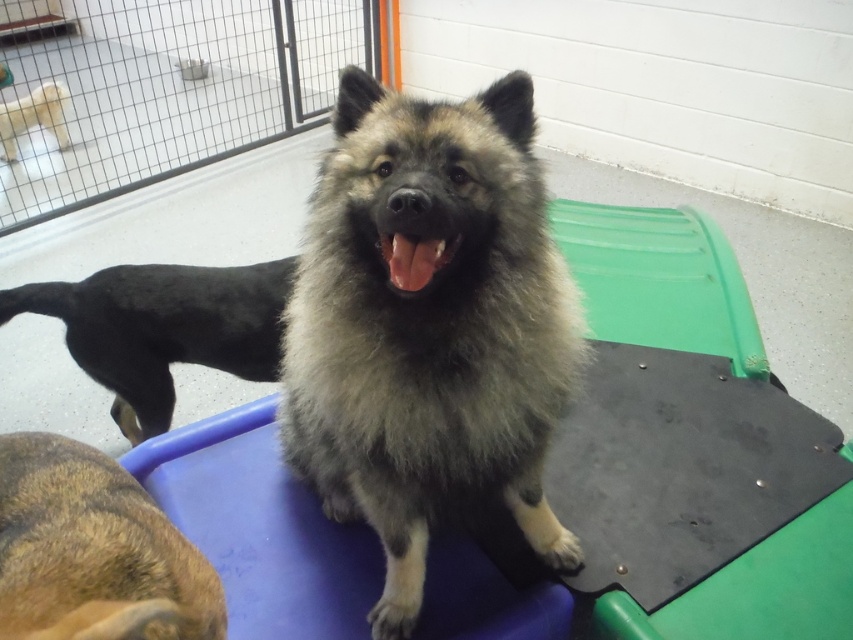
Is point (428, 220) behind point (10, 104)?

That is False.

Is fuzzy gray dog at center positioned at the back of light brown fur at upper left?

No.

Between point (310, 328) and point (28, 102), which one is positioned behind?

The point (28, 102) is behind.

Image resolution: width=853 pixels, height=640 pixels. Identify the location of fuzzy gray dog at center. (428, 326).

Measure the distance from brown fur at lower left to light brown fur at upper left.

brown fur at lower left is 4.10 meters from light brown fur at upper left.

Can you confirm if brown fur at lower left is positioned to the right of light brown fur at upper left?

Indeed, brown fur at lower left is positioned on the right side of light brown fur at upper left.

Which is in front, point (136, 561) or point (12, 136)?

Point (136, 561) is in front.

What are the coordinates of `brown fur at lower left` in the screenshot? It's located at (93, 552).

Does fuzzy gray dog at center appear over black fur dog at center?

No, fuzzy gray dog at center is not above black fur dog at center.

Is fuzzy gray dog at center positioned behind black fur dog at center?

No, it is not.

I want to click on fuzzy gray dog at center, so click(x=428, y=326).